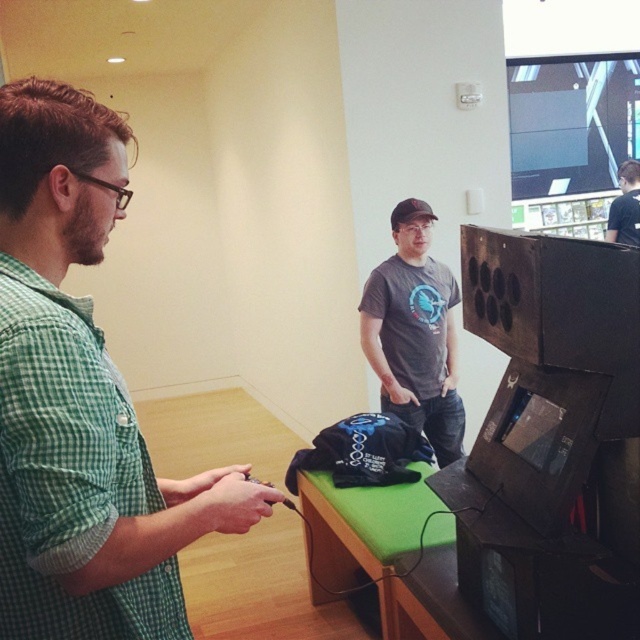
Who is more distant from viewer, (10, 548) or (637, 214)?

The point (637, 214) is behind.

Who is shorter, green checkered shirt at left or black matte shirt at center?

black matte shirt at center is shorter.

This screenshot has height=640, width=640. I want to click on green checkered shirt at left, so click(x=81, y=401).

Does green checkered shirt at left have a lesser height compared to gray matte t-shirt at center?

Yes, green checkered shirt at left is shorter than gray matte t-shirt at center.

Is green checkered shirt at left below gray matte t-shirt at center?

Indeed, green checkered shirt at left is positioned under gray matte t-shirt at center.

Locate an element on the screen. The image size is (640, 640). green checkered shirt at left is located at coordinates click(81, 401).

The width and height of the screenshot is (640, 640). What are the coordinates of `green checkered shirt at left` in the screenshot? It's located at (81, 401).

Does point (433, 324) lie in front of point (637, 212)?

That is True.

The width and height of the screenshot is (640, 640). Describe the element at coordinates (413, 333) in the screenshot. I see `gray matte t-shirt at center` at that location.

The image size is (640, 640). Find the location of `gray matte t-shirt at center`. gray matte t-shirt at center is located at coordinates (413, 333).